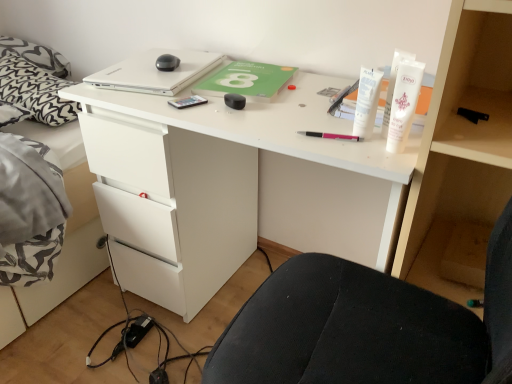
In order to click on vacant point to the right of satin silver phone at center, positioned as the 1th stationery in left-to-right order in this screenshot , I will do `click(254, 105)`.